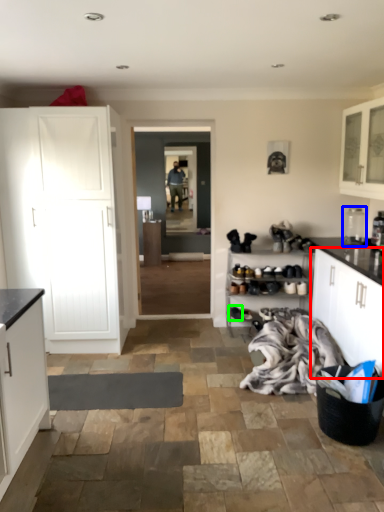
Question: Which object is the closest to the cabinetry (highlighted by a red box)? Choose among these: appliance (highlighted by a blue box) or footwear (highlighted by a green box).

Choices:
 (A) appliance
 (B) footwear

Answer: (A)